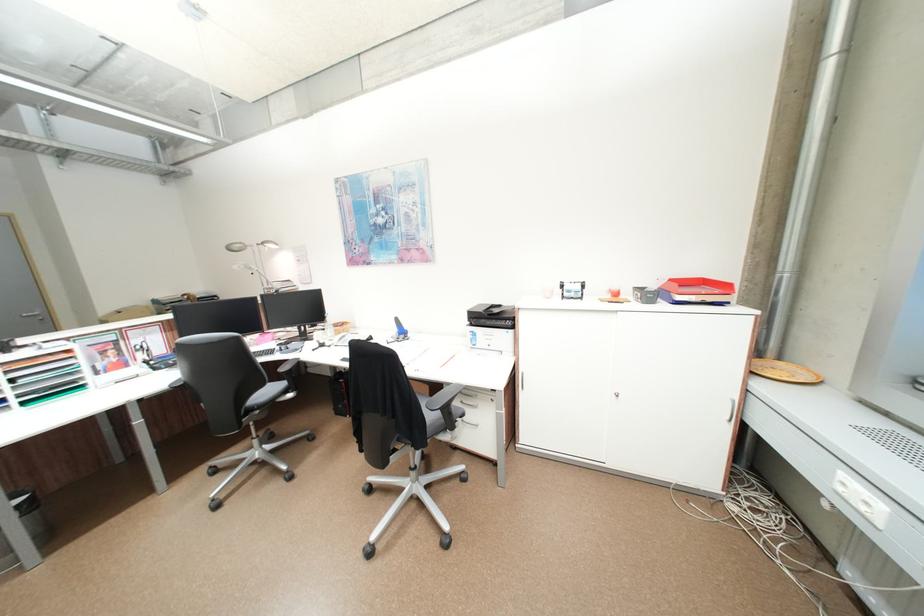
Find where to resting arm the grey chair armrest. Please return your answer as a coordinate pair (x, y).

(290, 368)